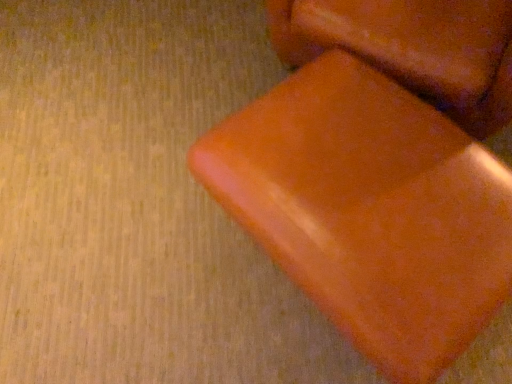
Locate an element on the screen. orange matte block at center is located at coordinates (x=413, y=48).

What do you see at coordinates (413, 48) in the screenshot?
I see `orange matte block at center` at bounding box center [413, 48].

The height and width of the screenshot is (384, 512). Describe the element at coordinates (370, 210) in the screenshot. I see `orange matte bean bag chair at center` at that location.

Identify the location of orange matte bean bag chair at center. Image resolution: width=512 pixels, height=384 pixels. (370, 210).

What are the coordinates of `orange matte block at center` in the screenshot? It's located at (413, 48).

Does orange matte bean bag chair at center appear on the left side of orange matte block at center?

Correct, you'll find orange matte bean bag chair at center to the left of orange matte block at center.

Between orange matte bean bag chair at center and orange matte block at center, which one is positioned behind?

Positioned behind is orange matte block at center.

From the picture: Which is closer to the camera, (424, 180) or (412, 17)?

The point (424, 180) is closer.

From the image's perspective, which is below, orange matte bean bag chair at center or orange matte block at center?

orange matte bean bag chair at center is shown below in the image.

Consider the image. From a real-world perspective, is orange matte bean bag chair at center positioned above or below orange matte block at center?

From a real-world perspective, orange matte bean bag chair at center is physically below orange matte block at center.

Which of these two, orange matte bean bag chair at center or orange matte block at center, is thinner?

With smaller width is orange matte bean bag chair at center.

Can you confirm if orange matte bean bag chair at center is shorter than orange matte block at center?

Indeed, orange matte bean bag chair at center has a lesser height compared to orange matte block at center.

Can you confirm if orange matte bean bag chair at center is bigger than orange matte block at center?

Actually, orange matte bean bag chair at center might be smaller than orange matte block at center.

Do you think orange matte bean bag chair at center is within orange matte block at center, or outside of it?

orange matte bean bag chair at center is not enclosed by orange matte block at center.

Is orange matte bean bag chair at center next to orange matte block at center?

No.

Does orange matte bean bag chair at center turn towards orange matte block at center?

No.

At what (x,y) coordinates should I click in order to perform the action: click on furniture lying behind the orange matte bean bag chair at center. Please return your answer as a coordinate pair (x, y). Looking at the image, I should click on tap(413, 48).

Considering the positions of objects orange matte block at center and orange matte bean bag chair at center in the image provided, who is more to the right, orange matte block at center or orange matte bean bag chair at center?

Result: Positioned to the right is orange matte block at center.

Which object is closer to the camera, orange matte block at center or orange matte bean bag chair at center?

Positioned in front is orange matte bean bag chair at center.

Does point (323, 16) appear closer or farther from the camera than point (432, 132)?

Point (323, 16).

From the image's perspective, relative to orange matte bean bag chair at center, is orange matte block at center above or below?

From the image's perspective, orange matte block at center appears above orange matte bean bag chair at center.

From a real-world perspective, is orange matte block at center physically below orange matte bean bag chair at center?

Actually, orange matte block at center is physically above orange matte bean bag chair at center in the real world.

Consider the image. Which object is wider, orange matte block at center or orange matte bean bag chair at center?

orange matte block at center.

Who is taller, orange matte block at center or orange matte bean bag chair at center?

With more height is orange matte block at center.

Does orange matte block at center have a larger size compared to orange matte bean bag chair at center?

Yes.

Is orange matte block at center positioned beyond the bounds of orange matte bean bag chair at center?

Yes, orange matte block at center is outside of orange matte bean bag chair at center.

Is orange matte block at center with orange matte bean bag chair at center?

No, orange matte block at center is not making contact with orange matte bean bag chair at center.

Could you tell me if orange matte block at center is turned towards orange matte bean bag chair at center?

Yes.

How different are the orientations of orange matte block at center and orange matte bean bag chair at center in degrees?

The facing directions of orange matte block at center and orange matte bean bag chair at center are 16.7 degrees apart.

Find the location of a particular element. This screenshot has width=512, height=384. furniture that appears on the right of orange matte bean bag chair at center is located at coordinates (413, 48).

Where is `furniture on the right of orange matte bean bag chair at center`? The width and height of the screenshot is (512, 384). furniture on the right of orange matte bean bag chair at center is located at coordinates (413, 48).

Find the location of a particular element. This screenshot has height=384, width=512. bean bag chair in front of the orange matte block at center is located at coordinates (370, 210).